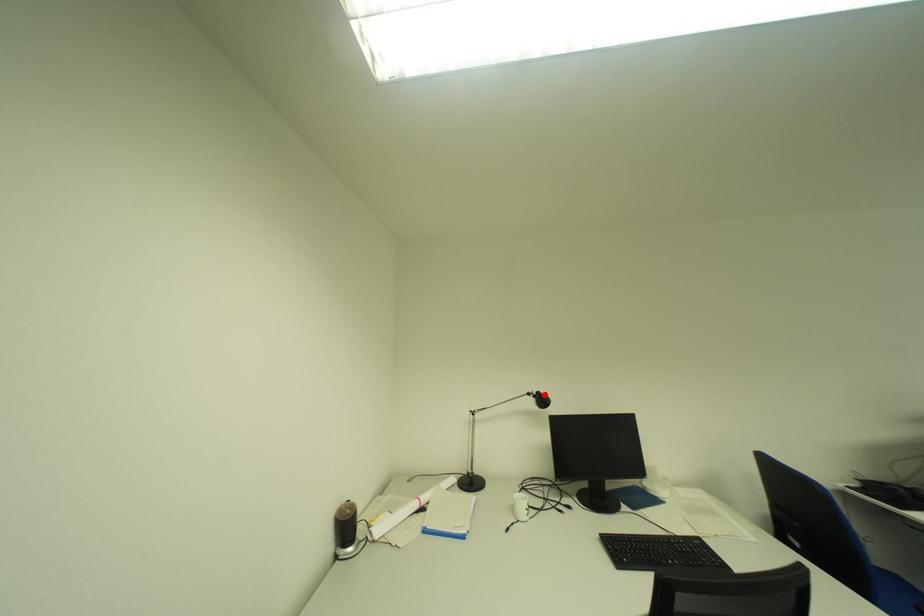
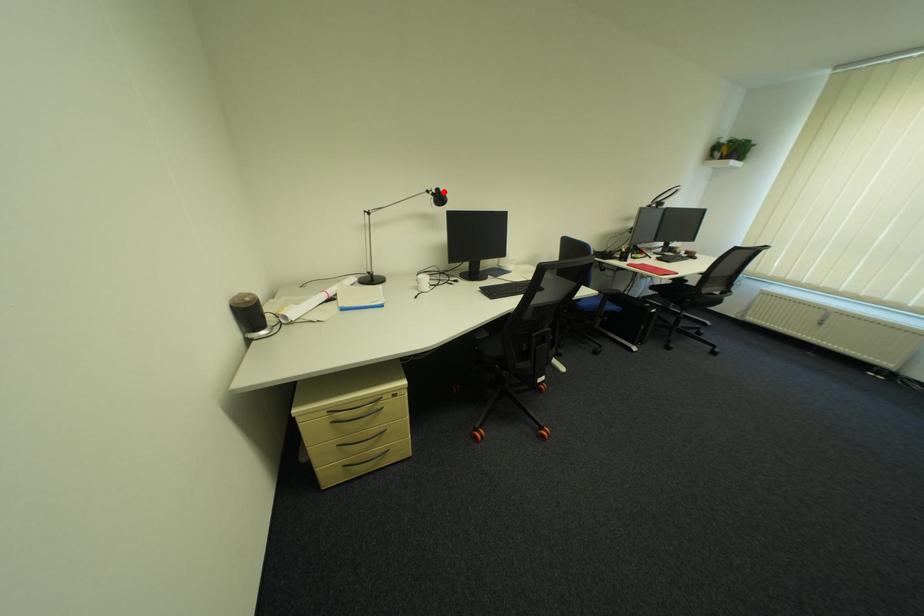
I am providing you with two images of the same scene from different viewpoints. A red point is marked on the first image and another point is marked on the second image. Do the highlighted points in image1 and image2 indicate the same real-world spot?

Yes